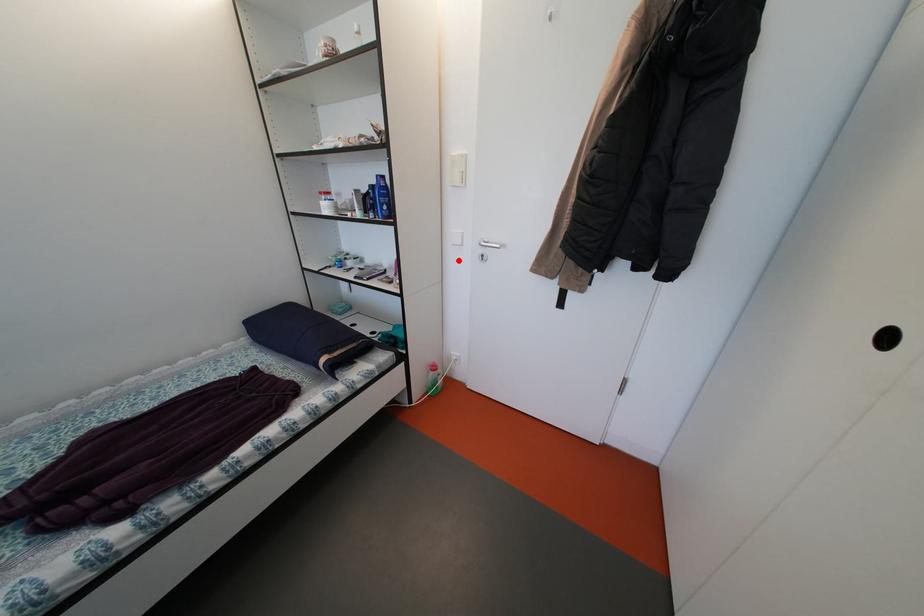
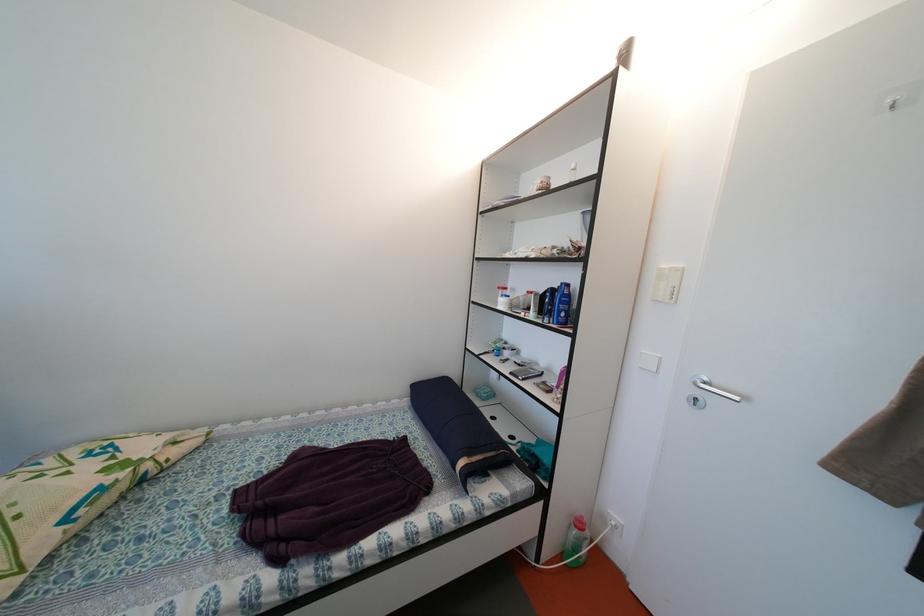
Question: A red point is marked in image1. In image2, is the corresponding 3D point closer to the camera or farther? Reply with the corresponding letter.

Choices:
 (A) The corresponding 3D point is closer.
 (B) The corresponding 3D point is farther.

Answer: (B)